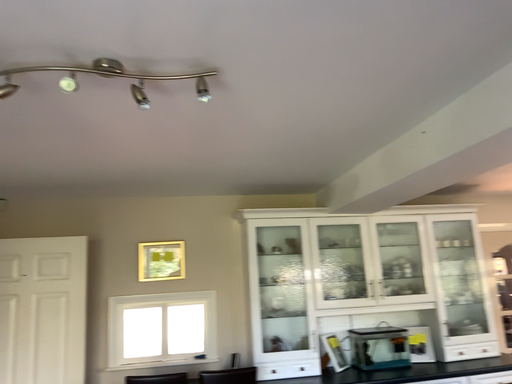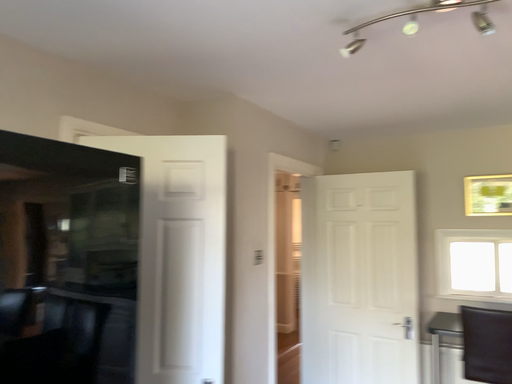
Question: Which way did the camera rotate in the video?

Choices:
 (A) rotated left
 (B) rotated right

Answer: (A)